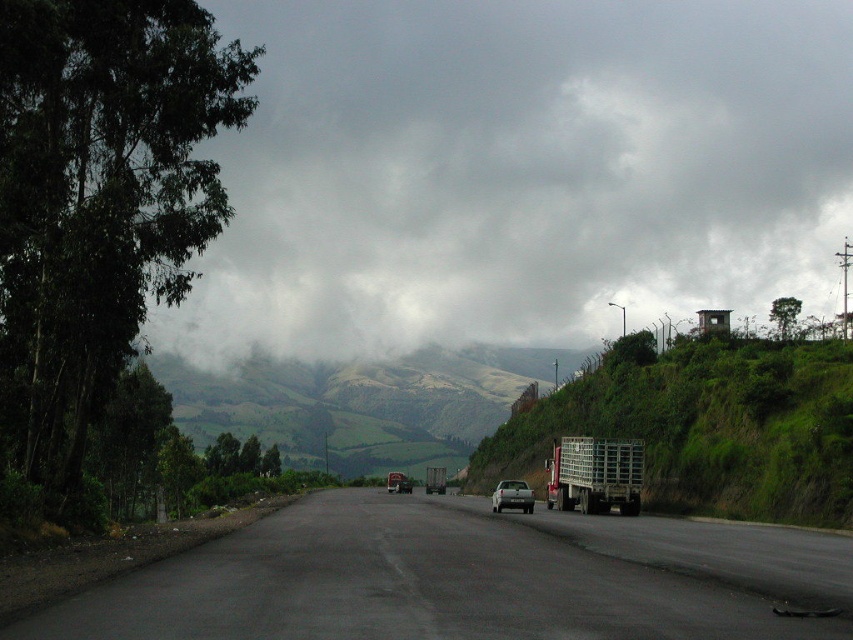
Can you confirm if cloudy sky at upper center is smaller than metallic silver trailer truck at right?

Actually, cloudy sky at upper center might be larger than metallic silver trailer truck at right.

Can you confirm if cloudy sky at upper center is positioned above metallic silver trailer truck at right?

Indeed, cloudy sky at upper center is positioned over metallic silver trailer truck at right.

The width and height of the screenshot is (853, 640). I want to click on cloudy sky at upper center, so click(520, 172).

Does point (527, 497) come behind point (409, 486)?

No, (527, 497) is closer to viewer.

Between silver metallic car at center and metallic silver truck at center, which one is positioned higher?

silver metallic car at center is above.

Between point (515, 496) and point (399, 481), which one is positioned in front?

Point (515, 496) is in front.

Identify the location of silver metallic car at center. The height and width of the screenshot is (640, 853). (512, 497).

Who is shorter, asphalt road at center or metallic silver trailer truck at right?

metallic silver trailer truck at right

Measure the distance between asphalt road at center and metallic silver trailer truck at right.

They are 37.72 feet apart.

Does point (492, 580) lie in front of point (618, 474)?

That is True.

Image resolution: width=853 pixels, height=640 pixels. Find the location of `asphalt road at center`. asphalt road at center is located at coordinates (469, 579).